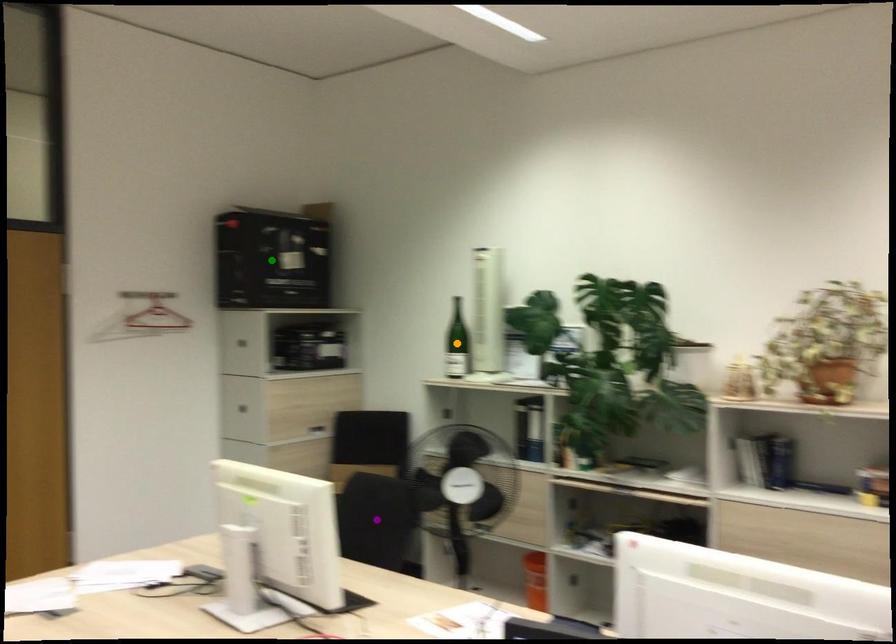
Order these from farthest to nearest:
1. orange point
2. purple point
3. green point

1. green point
2. orange point
3. purple point